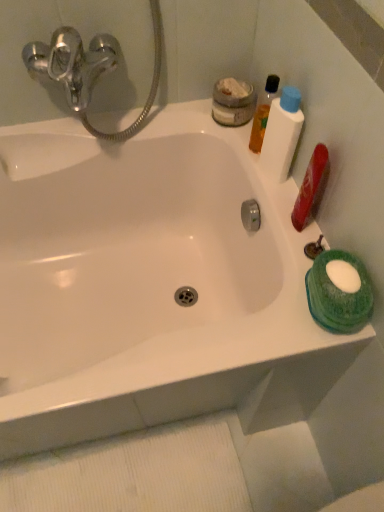
The width and height of the screenshot is (384, 512). What are the coordinates of `translucent orange liquid at upper right, the second mouthwash positioned from the top` in the screenshot? It's located at (263, 113).

Image resolution: width=384 pixels, height=512 pixels. I want to click on red matte bottle at right, which is counted as the second mouthwash, starting from the bottom, so click(x=309, y=186).

You are a GUI agent. You are given a task and a screenshot of the screen. Output one action in this format:
    pyautogui.click(x=<x>, y=<y>)
    Task: Click on the translucent orange liquid at upper right, the second mouthwash positioned from the top
    
    Given the screenshot: What is the action you would take?
    pyautogui.click(x=263, y=113)

Is white plastic bottle at upper right, the third mouthwash positioned from the bottom, not inside red matte bottle at right, which is counted as the second mouthwash, starting from the bottom?

Yes, white plastic bottle at upper right, the third mouthwash positioned from the bottom, is located beyond the bounds of red matte bottle at right, which is counted as the second mouthwash, starting from the bottom.

Is white plastic bottle at upper right, which appears as the 3th mouthwash when viewed from the top, oriented towards red matte bottle at right, placed as the fourth mouthwash when sorted from top to bottom?

No, white plastic bottle at upper right, which appears as the 3th mouthwash when viewed from the top, is not turned towards red matte bottle at right, placed as the fourth mouthwash when sorted from top to bottom.

From the picture: Considering the relative sizes of white plastic bottle at upper right, which appears as the 3th mouthwash when viewed from the top, and red matte bottle at right, placed as the fourth mouthwash when sorted from top to bottom, in the image provided, is white plastic bottle at upper right, which appears as the 3th mouthwash when viewed from the top, smaller than red matte bottle at right, placed as the fourth mouthwash when sorted from top to bottom,?

Actually, white plastic bottle at upper right, which appears as the 3th mouthwash when viewed from the top, might be larger than red matte bottle at right, placed as the fourth mouthwash when sorted from top to bottom.

From the image's perspective, is white plastic bottle at upper right, which appears as the 3th mouthwash when viewed from the top, on top of red matte bottle at right, which is counted as the second mouthwash, starting from the bottom?

Yes, from the image's perspective, white plastic bottle at upper right, which appears as the 3th mouthwash when viewed from the top, is above red matte bottle at right, which is counted as the second mouthwash, starting from the bottom.

Would you say matte gray jar at upper right, placed as the fifth mouthwash when sorted from bottom to top, is part of white plastic bottle at upper right, which appears as the 3th mouthwash when viewed from the top,'s contents?

No, white plastic bottle at upper right, which appears as the 3th mouthwash when viewed from the top, does not contain matte gray jar at upper right, placed as the fifth mouthwash when sorted from bottom to top.

Is white plastic bottle at upper right, which appears as the 3th mouthwash when viewed from the top, touching matte gray jar at upper right, placed as the first mouthwash when sorted from top to bottom?

They are not placed beside each other.

The image size is (384, 512). What are the coordinates of `the 2nd mouthwash counting from the right side of the matte gray jar at upper right, placed as the fifth mouthwash when sorted from bottom to top` in the screenshot? It's located at (282, 134).

From the image's perspective, which object appears higher, white plastic bottle at upper right, which appears as the 3th mouthwash when viewed from the top, or matte gray jar at upper right, placed as the fifth mouthwash when sorted from bottom to top?

matte gray jar at upper right, placed as the fifth mouthwash when sorted from bottom to top, is shown above in the image.

Which object is closer to the camera taking this photo, matte gray jar at upper right, placed as the first mouthwash when sorted from top to bottom, or white plastic bottle at upper right, the third mouthwash positioned from the bottom?

Positioned in front is white plastic bottle at upper right, the third mouthwash positioned from the bottom.

From the image's perspective, is matte gray jar at upper right, placed as the fifth mouthwash when sorted from bottom to top, below white plastic bottle at upper right, which appears as the 3th mouthwash when viewed from the top?

Incorrect, from the image's perspective, matte gray jar at upper right, placed as the fifth mouthwash when sorted from bottom to top, is higher than white plastic bottle at upper right, which appears as the 3th mouthwash when viewed from the top.

How many degrees apart are the facing directions of matte gray jar at upper right, placed as the fifth mouthwash when sorted from bottom to top, and white plastic bottle at upper right, the third mouthwash positioned from the bottom?

They differ by 0.000143 degrees in their facing directions.

Is matte gray jar at upper right, placed as the first mouthwash when sorted from top to bottom, turned away from white plastic bottle at upper right, the third mouthwash positioned from the bottom?

matte gray jar at upper right, placed as the first mouthwash when sorted from top to bottom, is not turned away from white plastic bottle at upper right, the third mouthwash positioned from the bottom.

Can you confirm if green sponge at right, which appears as the 5th mouthwash when viewed from the top, is taller than matte gray jar at upper right, placed as the fifth mouthwash when sorted from bottom to top?

Indeed, green sponge at right, which appears as the 5th mouthwash when viewed from the top, has a greater height compared to matte gray jar at upper right, placed as the fifth mouthwash when sorted from bottom to top.

Measure the distance between green sponge at right, placed as the first mouthwash when sorted from bottom to top, and matte gray jar at upper right, placed as the fifth mouthwash when sorted from bottom to top.

green sponge at right, placed as the first mouthwash when sorted from bottom to top, and matte gray jar at upper right, placed as the fifth mouthwash when sorted from bottom to top, are 20.55 inches apart.

Considering the positions of point (328, 316) and point (215, 99), is point (328, 316) closer or farther from the camera than point (215, 99)?

Point (328, 316) appears to be closer to the viewer than point (215, 99).

Consider the image. Is translucent orange liquid at upper right, which is counted as the fourth mouthwash, starting from the bottom, positioned behind white plastic bottle at upper right, which appears as the 3th mouthwash when viewed from the top?

That is True.

From a real-world perspective, is translucent orange liquid at upper right, the second mouthwash positioned from the top, located higher than white plastic bottle at upper right, the third mouthwash positioned from the bottom?

No, from a real-world perspective, translucent orange liquid at upper right, the second mouthwash positioned from the top, is not on top of white plastic bottle at upper right, the third mouthwash positioned from the bottom.

Is translucent orange liquid at upper right, which is counted as the fourth mouthwash, starting from the bottom, thinner than white plastic bottle at upper right, which appears as the 3th mouthwash when viewed from the top?

Yes.

Is there a large distance between translucent orange liquid at upper right, the second mouthwash positioned from the top, and white plastic bottle at upper right, which appears as the 3th mouthwash when viewed from the top?

translucent orange liquid at upper right, the second mouthwash positioned from the top, is near white plastic bottle at upper right, which appears as the 3th mouthwash when viewed from the top, not far away.

Is red matte bottle at right, which is counted as the second mouthwash, starting from the bottom, shorter than matte gray jar at upper right, placed as the first mouthwash when sorted from top to bottom?

In fact, red matte bottle at right, which is counted as the second mouthwash, starting from the bottom, may be taller than matte gray jar at upper right, placed as the first mouthwash when sorted from top to bottom.

Is red matte bottle at right, which is counted as the second mouthwash, starting from the bottom, outside of matte gray jar at upper right, placed as the first mouthwash when sorted from top to bottom?

red matte bottle at right, which is counted as the second mouthwash, starting from the bottom, lies outside matte gray jar at upper right, placed as the first mouthwash when sorted from top to bottom,'s area.

Could you tell me if red matte bottle at right, which is counted as the second mouthwash, starting from the bottom, is turned towards matte gray jar at upper right, placed as the first mouthwash when sorted from top to bottom?

No, red matte bottle at right, which is counted as the second mouthwash, starting from the bottom, is not oriented towards matte gray jar at upper right, placed as the first mouthwash when sorted from top to bottom.

In the image, is red matte bottle at right, which is counted as the second mouthwash, starting from the bottom, on the left side or the right side of matte gray jar at upper right, placed as the first mouthwash when sorted from top to bottom?

From the image, it's evident that red matte bottle at right, which is counted as the second mouthwash, starting from the bottom, is to the right of matte gray jar at upper right, placed as the first mouthwash when sorted from top to bottom.

Does translucent orange liquid at upper right, which is counted as the fourth mouthwash, starting from the bottom, touch matte gray jar at upper right, placed as the first mouthwash when sorted from top to bottom?

Yes, translucent orange liquid at upper right, which is counted as the fourth mouthwash, starting from the bottom, is beside matte gray jar at upper right, placed as the first mouthwash when sorted from top to bottom.

Is matte gray jar at upper right, placed as the fifth mouthwash when sorted from bottom to top, completely or partially inside translucent orange liquid at upper right, the second mouthwash positioned from the top?

No, matte gray jar at upper right, placed as the fifth mouthwash when sorted from bottom to top, is located outside of translucent orange liquid at upper right, the second mouthwash positioned from the top.

From a real-world perspective, is translucent orange liquid at upper right, the second mouthwash positioned from the top, on matte gray jar at upper right, placed as the first mouthwash when sorted from top to bottom?

Correct, in the physical world, translucent orange liquid at upper right, the second mouthwash positioned from the top, is higher than matte gray jar at upper right, placed as the first mouthwash when sorted from top to bottom.

Considering the relative sizes of translucent orange liquid at upper right, which is counted as the fourth mouthwash, starting from the bottom, and matte gray jar at upper right, placed as the fifth mouthwash when sorted from bottom to top, in the image provided, is translucent orange liquid at upper right, which is counted as the fourth mouthwash, starting from the bottom, thinner than matte gray jar at upper right, placed as the fifth mouthwash when sorted from bottom to top,?

Yes, translucent orange liquid at upper right, which is counted as the fourth mouthwash, starting from the bottom, is thinner than matte gray jar at upper right, placed as the fifth mouthwash when sorted from bottom to top.

There is a red matte bottle at right, which is counted as the second mouthwash, starting from the bottom. At what (x,y) coordinates should I click in order to perform the action: click on the 1st mouthwash above it (from the image's perspective). Please return your answer as a coordinate pair (x, y). This screenshot has height=512, width=384. Looking at the image, I should click on (282, 134).

From the image's perspective, starting from the matte gray jar at upper right, placed as the fifth mouthwash when sorted from bottom to top, which mouthwash is the 2nd one below? Please provide its 2D coordinates.

[(282, 134)]

From the image, which object appears to be nearer to red matte bottle at right, which is counted as the second mouthwash, starting from the bottom, matte gray jar at upper right, placed as the fifth mouthwash when sorted from bottom to top, or translucent orange liquid at upper right, which is counted as the fourth mouthwash, starting from the bottom?

translucent orange liquid at upper right, which is counted as the fourth mouthwash, starting from the bottom.

Looking at the image, which one is located further to green sponge at right, which appears as the 5th mouthwash when viewed from the top, matte gray jar at upper right, placed as the first mouthwash when sorted from top to bottom, or red matte bottle at right, which is counted as the second mouthwash, starting from the bottom?

Based on the image, matte gray jar at upper right, placed as the first mouthwash when sorted from top to bottom, appears to be further to green sponge at right, which appears as the 5th mouthwash when viewed from the top.

From the image, which object appears to be farther from white plastic bottle at upper right, which appears as the 3th mouthwash when viewed from the top, translucent orange liquid at upper right, the second mouthwash positioned from the top, or red matte bottle at right, which is counted as the second mouthwash, starting from the bottom?

red matte bottle at right, which is counted as the second mouthwash, starting from the bottom, lies further to white plastic bottle at upper right, which appears as the 3th mouthwash when viewed from the top, than the other object.

Considering their positions, is matte gray jar at upper right, placed as the first mouthwash when sorted from top to bottom, positioned closer to translucent orange liquid at upper right, the second mouthwash positioned from the top, than green sponge at right, which appears as the 5th mouthwash when viewed from the top?

matte gray jar at upper right, placed as the first mouthwash when sorted from top to bottom, is closer to translucent orange liquid at upper right, the second mouthwash positioned from the top.

Looking at the image, which one is located closer to white plastic bottle at upper right, which appears as the 3th mouthwash when viewed from the top, red matte bottle at right, placed as the fourth mouthwash when sorted from top to bottom, or translucent orange liquid at upper right, which is counted as the fourth mouthwash, starting from the bottom?

translucent orange liquid at upper right, which is counted as the fourth mouthwash, starting from the bottom, is positioned closer to the anchor white plastic bottle at upper right, which appears as the 3th mouthwash when viewed from the top.

Which object lies nearer to the anchor point green sponge at right, which appears as the 5th mouthwash when viewed from the top, red matte bottle at right, which is counted as the second mouthwash, starting from the bottom, or translucent orange liquid at upper right, the second mouthwash positioned from the top?

Among the two, red matte bottle at right, which is counted as the second mouthwash, starting from the bottom, is located nearer to green sponge at right, which appears as the 5th mouthwash when viewed from the top.

Based on their spatial positions, is matte gray jar at upper right, placed as the fifth mouthwash when sorted from bottom to top, or translucent orange liquid at upper right, the second mouthwash positioned from the top, further from green sponge at right, which appears as the 5th mouthwash when viewed from the top?

Based on the image, matte gray jar at upper right, placed as the fifth mouthwash when sorted from bottom to top, appears to be further to green sponge at right, which appears as the 5th mouthwash when viewed from the top.

Consider the image. Considering their positions, is matte gray jar at upper right, placed as the first mouthwash when sorted from top to bottom, positioned closer to red matte bottle at right, placed as the fourth mouthwash when sorted from top to bottom, than white plastic bottle at upper right, the third mouthwash positioned from the bottom?

white plastic bottle at upper right, the third mouthwash positioned from the bottom, is positioned closer to the anchor red matte bottle at right, placed as the fourth mouthwash when sorted from top to bottom.

The width and height of the screenshot is (384, 512). Find the location of `mouthwash between translucent orange liquid at upper right, which is counted as the fourth mouthwash, starting from the bottom, and red matte bottle at right, placed as the fourth mouthwash when sorted from top to bottom, vertically`. mouthwash between translucent orange liquid at upper right, which is counted as the fourth mouthwash, starting from the bottom, and red matte bottle at right, placed as the fourth mouthwash when sorted from top to bottom, vertically is located at coordinates (282, 134).

Locate an element on the screen. This screenshot has width=384, height=512. mouthwash between white plastic bottle at upper right, the third mouthwash positioned from the bottom, and green sponge at right, which appears as the 5th mouthwash when viewed from the top, from top to bottom is located at coordinates (309, 186).

Locate an element on the screen. The height and width of the screenshot is (512, 384). mouthwash between white plastic bottle at upper right, the third mouthwash positioned from the bottom, and matte gray jar at upper right, placed as the first mouthwash when sorted from top to bottom, along the z-axis is located at coordinates (263, 113).